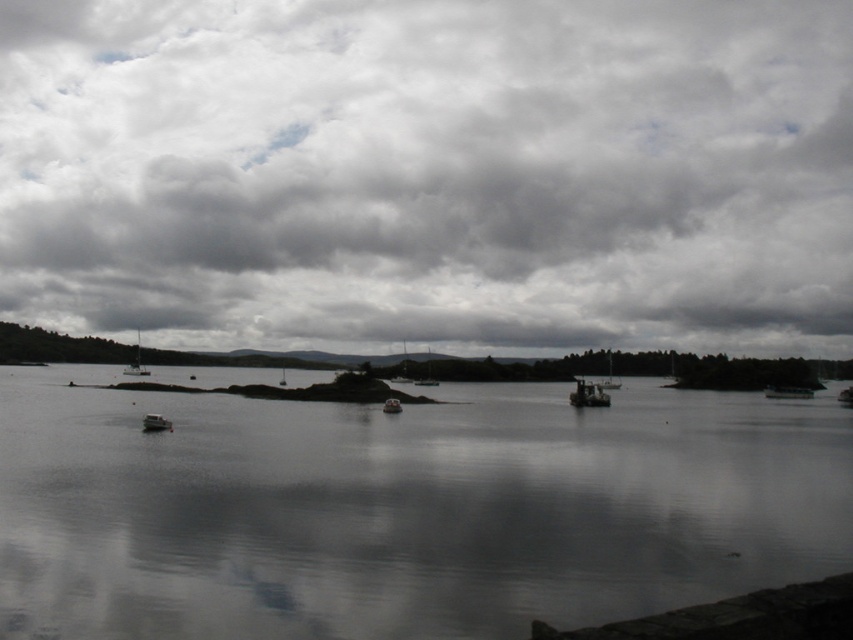
Question: Which point is farther to the camera?

Choices:
 (A) (708, 484)
 (B) (387, 404)
 (C) (810, 392)
 (D) (242, 113)

Answer: (D)

Question: Does smooth water at center have a larger size compared to metallic gray boat at lower right?

Choices:
 (A) yes
 (B) no

Answer: (A)

Question: Is metallic silver boat at lower left bigger than metallic gray boat at center?

Choices:
 (A) yes
 (B) no

Answer: (A)

Question: Estimate the real-world distances between objects in this image. Which object is closer to the white glossy sailboat at left?

Choices:
 (A) metallic gray boat at center
 (B) metallic silver boat at lower left

Answer: (A)

Question: Among these objects, which one is farthest from the camera?

Choices:
 (A) cloudy sky at upper center
 (B) smooth water at center
 (C) metallic silver boat at lower left
 (D) white glossy sailboat at left

Answer: (A)

Question: Can you confirm if metallic silver boat at lower left is smaller than metallic gray boat at center?

Choices:
 (A) no
 (B) yes

Answer: (A)